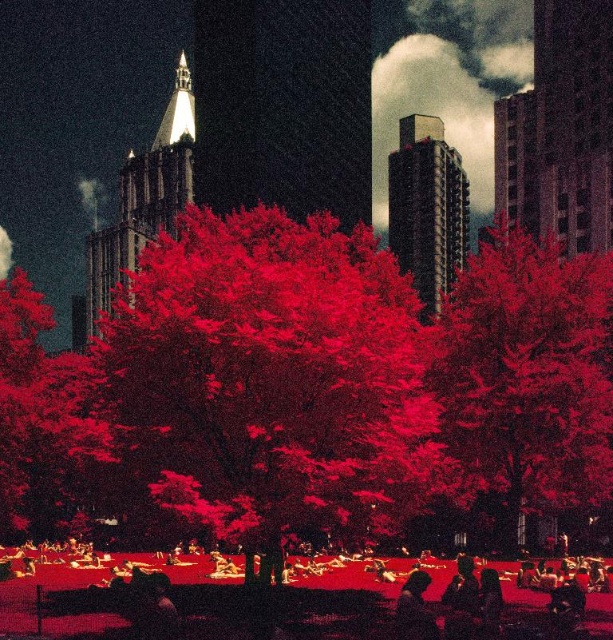
You are a photographer standing at the edge of a park. You want to take a photo of the smooth skin person at lower center while ensuring the vivid red leaves at center are also in the frame. Given that your camera has a maximum focus range of 10 meters, will you be able to capture both subjects clearly?

The distance between the vivid red leaves at center and the smooth skin person at lower center is 11.53 meters. Since your camera can only focus up to 10 meters, you won not be able to capture both subjects clearly within the same frame.

You are standing in the urban scene and want to take a photo of both point (196, 404) and point (55, 566). Which point should you focus on first to ensure both are in sharp focus?

You should focus on point (196, 404) first because it is closer to the camera than point (55, 566), ensuring the depth of field captures both points clearly.